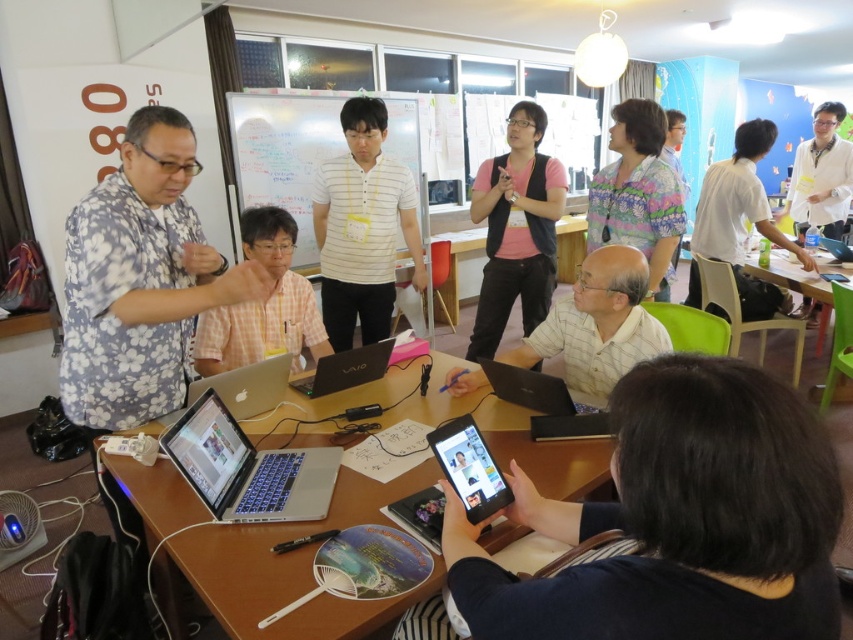
Does matte yellow shirt at center have a lesser height compared to green plastic table at right?

No.

Is point (621, 374) farther from viewer compared to point (817, 260)?

That is False.

Who is more forward, (x=639, y=296) or (x=820, y=284)?

Point (x=639, y=296) is more forward.

The height and width of the screenshot is (640, 853). I want to click on matte yellow shirt at center, so click(x=596, y=324).

Is black glossy tablet at center further to camera compared to wooden table at center?

No.

Is point (723, 534) farther from viewer compared to point (467, 237)?

No, (723, 534) is in front of (467, 237).

Who is more forward, (660, 540) or (447, 305)?

Positioned in front is point (660, 540).

The image size is (853, 640). What are the coordinates of `black glossy tablet at center` in the screenshot? It's located at (677, 518).

Is point (325, 618) positioned before point (460, 476)?

Yes, it is.

Between point (143, 468) and point (502, 492), which one is positioned behind?

The point (143, 468) is behind.

Which is behind, point (180, 486) or point (467, 428)?

The point (180, 486) is behind.

Locate an element on the screen. silver metallic table at center is located at coordinates (283, 568).